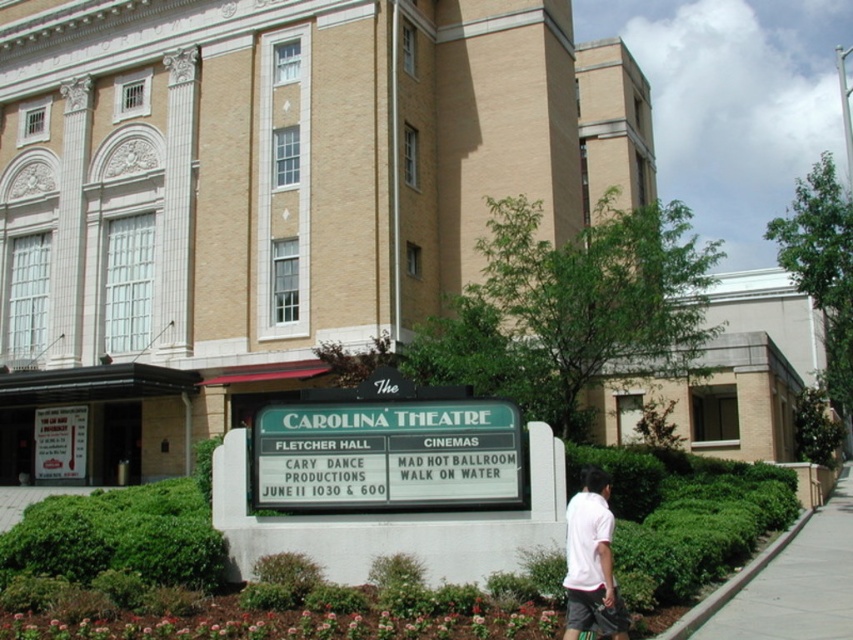
You are standing in front of the Carolina Theatre and want to locate the green plastic sign at center. According to the coordinates provided, where should you look?

You should look at point (386, 454) to find the green plastic sign at center.

You are a visitor arriving at the Carolina Theatre and see the green plastic sign at center and the green grass at lower left. Which object is positioned more to the right from your perspective?

The green plastic sign at center is positioned more to the right than the green grass at lower left.

You are standing in front of the Carolina Theatre and want to read the green plastic sign at center. There is green grass at lower left nearby. Which object is closer to you?

The green plastic sign at center is closer to the viewer than the green grass at lower left.